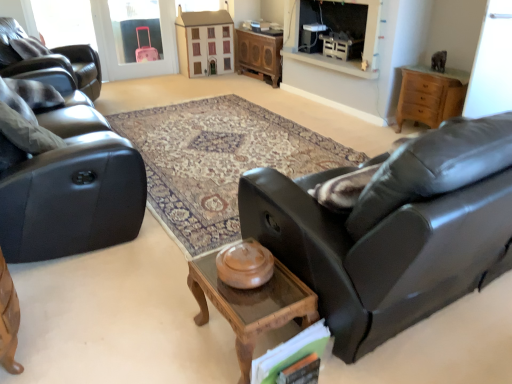
The image size is (512, 384). Find the location of `free space to the left of wooden cabinet at right`. free space to the left of wooden cabinet at right is located at coordinates (375, 132).